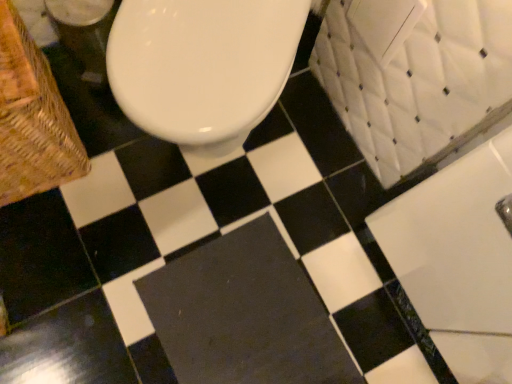
You are a GUI agent. You are given a task and a screenshot of the screen. Output one action in this format:
    pyautogui.click(x=<x>, y=<y>)
    Task: Click on the woven wood basket at left
    This screenshot has width=512, height=384.
    Given the screenshot: What is the action you would take?
    pyautogui.click(x=32, y=118)

What do you see at coordinates (454, 242) in the screenshot? Image resolution: width=512 pixels, height=384 pixels. I see `white glossy bath at upper right` at bounding box center [454, 242].

Where is `dark gray rubber bath mat at center`? dark gray rubber bath mat at center is located at coordinates (244, 314).

Choose the correct answer: Is dark gray rubber bath mat at center inside woven wood basket at left or outside it?

dark gray rubber bath mat at center exists outside the volume of woven wood basket at left.

Considering the relative sizes of dark gray rubber bath mat at center and woven wood basket at left in the image provided, is dark gray rubber bath mat at center smaller than woven wood basket at left?

Yes, dark gray rubber bath mat at center is smaller than woven wood basket at left.

Is there a large distance between dark gray rubber bath mat at center and woven wood basket at left?

That's not correct — dark gray rubber bath mat at center is a little close to woven wood basket at left.

Looking at this image, is the depth of dark gray rubber bath mat at center greater than that of woven wood basket at left?

That is True.

Is woven wood basket at left to the right of dark gray rubber bath mat at center from the viewer's perspective?

No, woven wood basket at left is not to the right of dark gray rubber bath mat at center.

Which is in front, woven wood basket at left or dark gray rubber bath mat at center?

woven wood basket at left.

Considering the sizes of woven wood basket at left and dark gray rubber bath mat at center in the image, is woven wood basket at left bigger or smaller than dark gray rubber bath mat at center?

In the image, woven wood basket at left appears to be larger than dark gray rubber bath mat at center.

Who is taller, woven wood basket at left or dark gray rubber bath mat at center?

woven wood basket at left is taller.

In order to click on bath mat that appears on the left of white glossy bath at upper right in this screenshot , I will do `click(244, 314)`.

Considering the sizes of objects dark gray rubber bath mat at center and white glossy bath at upper right in the image provided, who is taller, dark gray rubber bath mat at center or white glossy bath at upper right?

With more height is white glossy bath at upper right.

In the scene shown: Is dark gray rubber bath mat at center next to white glossy bath at upper right and touching it?

No, dark gray rubber bath mat at center is not touching white glossy bath at upper right.

This screenshot has height=384, width=512. Identify the location of basket beneath the white glossy bath at upper right (from a real-world perspective). (32, 118).

Between white glossy bath at upper right and woven wood basket at left, which one has smaller size?

woven wood basket at left.

Are white glossy bath at upper right and woven wood basket at left located far from each other?

They are positioned close to each other.

Does white glossy bath at upper right have a lesser width compared to woven wood basket at left?

Yes.

From a real-world perspective, is white glossy bath at upper right physically located above or below dark gray rubber bath mat at center?

white glossy bath at upper right is above dark gray rubber bath mat at center.

Is white glossy bath at upper right in contact with dark gray rubber bath mat at center?

No, white glossy bath at upper right is not with dark gray rubber bath mat at center.

Relative to dark gray rubber bath mat at center, is white glossy bath at upper right in front or behind?

Visually, white glossy bath at upper right is located in front of dark gray rubber bath mat at center.

From their relative heights in the image, would you say woven wood basket at left is taller or shorter than white glossy bath at upper right?

woven wood basket at left is shorter than white glossy bath at upper right.

Is woven wood basket at left wider or thinner than white glossy bath at upper right?

Considering their sizes, woven wood basket at left looks broader than white glossy bath at upper right.

Are woven wood basket at left and white glossy bath at upper right making contact?

There is a gap between woven wood basket at left and white glossy bath at upper right.

Find the location of a particular element. This screenshot has width=512, height=384. basket on the left of white glossy bath at upper right is located at coordinates (32, 118).

This screenshot has height=384, width=512. In order to click on bath mat below the woven wood basket at left (from the image's perspective) in this screenshot , I will do `click(244, 314)`.

At what (x,y) coordinates should I click in order to perform the action: click on basket on the left side of dark gray rubber bath mat at center. Please return your answer as a coordinate pair (x, y). Looking at the image, I should click on (32, 118).

Considering their positions, is woven wood basket at left positioned closer to dark gray rubber bath mat at center than white glossy bath at upper right?

white glossy bath at upper right.

Based on their spatial positions, is dark gray rubber bath mat at center or woven wood basket at left closer to white glossy bath at upper right?

dark gray rubber bath mat at center is positioned closer to the anchor white glossy bath at upper right.

Which object lies nearer to the anchor point dark gray rubber bath mat at center, white glossy bath at upper right or woven wood basket at left?

Among the two, white glossy bath at upper right is located nearer to dark gray rubber bath mat at center.

Considering their positions, is dark gray rubber bath mat at center positioned closer to woven wood basket at left than white glossy bath at upper right?

dark gray rubber bath mat at center lies closer to woven wood basket at left than the other object.

In the scene shown: When comparing their distances from woven wood basket at left, does white glossy bath at upper right or dark gray rubber bath mat at center seem further?

white glossy bath at upper right is further to woven wood basket at left.

Estimate the real-world distances between objects in this image. Which object is closer to white glossy bath at upper right, woven wood basket at left or dark gray rubber bath mat at center?

dark gray rubber bath mat at center is positioned closer to the anchor white glossy bath at upper right.

Locate an element on the screen. The width and height of the screenshot is (512, 384). bath mat between woven wood basket at left and white glossy bath at upper right from left to right is located at coordinates (244, 314).